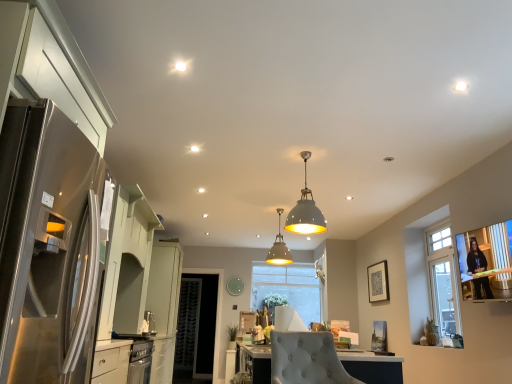
This screenshot has width=512, height=384. What do you see at coordinates (48, 246) in the screenshot? I see `stainless steel refrigerator at left` at bounding box center [48, 246].

What do you see at coordinates (486, 262) in the screenshot? I see `glass window screen at right` at bounding box center [486, 262].

This screenshot has height=384, width=512. I want to click on glass window screen at right, so click(x=486, y=262).

This screenshot has width=512, height=384. In order to click on matte black picture frame at upper right in this screenshot , I will do 378,282.

In order to click on white glossy countertop at lower left in this screenshot , I will do `click(112, 361)`.

What are the coordinates of `clear glass door at center` in the screenshot? It's located at (197, 325).

Describe the element at coordinates (149, 323) in the screenshot. This screenshot has height=384, width=512. I see `satin nickel faucet at lower left` at that location.

This screenshot has width=512, height=384. In order to click on stainless steel refrigerator at left in this screenshot , I will do click(x=48, y=246).

Is satin nickel faucet at lower left next to clear glass window at center and touching it?

No, satin nickel faucet at lower left is not making contact with clear glass window at center.

From the picture: Considering the sizes of objects satin nickel faucet at lower left and clear glass window at center in the image provided, who is shorter, satin nickel faucet at lower left or clear glass window at center?

Standing shorter between the two is satin nickel faucet at lower left.

In the scene shown: Is clear glass window at center inside satin nickel faucet at lower left?

No.

Is glass window screen at right positioned behind stainless steel refrigerator at left?

Yes, glass window screen at right is further from the camera.

Are glass window screen at right and stainless steel refrigerator at left beside each other?

No, glass window screen at right is not touching stainless steel refrigerator at left.

Which is less distant, (x=504, y=289) or (x=49, y=244)?

Point (x=504, y=289) is positioned farther from the camera compared to point (x=49, y=244).

Which of these two, glass window screen at right or stainless steel refrigerator at left, is smaller?

glass window screen at right is smaller.

From the image's perspective, does satin nickel faucet at lower left appear lower than matte black picture frame at upper right?

Yes, from the image's perspective, satin nickel faucet at lower left is beneath matte black picture frame at upper right.

Is point (151, 322) farther from camera compared to point (381, 296)?

No, (151, 322) is in front of (381, 296).

Based on the photo, in terms of size, does satin nickel faucet at lower left appear bigger or smaller than matte black picture frame at upper right?

Clearly, satin nickel faucet at lower left is smaller in size than matte black picture frame at upper right.

Is matte black picture frame at upper right aimed at stainless steel refrigerator at left?

No.

Can you confirm if matte black picture frame at upper right is thinner than stainless steel refrigerator at left?

Yes, matte black picture frame at upper right is thinner than stainless steel refrigerator at left.

Would you say matte black picture frame at upper right contains stainless steel refrigerator at left?

No, matte black picture frame at upper right does not contain stainless steel refrigerator at left.

Considering the relative sizes of matte black picture frame at upper right and white matte pendant light at center, acting as the first lamp starting from the top, in the image provided, is matte black picture frame at upper right shorter than white matte pendant light at center, acting as the first lamp starting from the top,?

Correct, matte black picture frame at upper right is not as tall as white matte pendant light at center, acting as the first lamp starting from the top.

Is matte black picture frame at upper right oriented away from white matte pendant light at center, acting as the first lamp starting from the top?

matte black picture frame at upper right does not have its back to white matte pendant light at center, acting as the first lamp starting from the top.

Image resolution: width=512 pixels, height=384 pixels. Find the location of `picture frame located on the right of white matte pendant light at center, acting as the 2th lamp starting from the bottom`. picture frame located on the right of white matte pendant light at center, acting as the 2th lamp starting from the bottom is located at coordinates (378, 282).

Which is behind, matte black picture frame at upper right or white matte pendant light at center, acting as the 2th lamp starting from the bottom?

matte black picture frame at upper right.

Does glass window screen at right appear on the right side of matte gray pendant light at center, which is the 2th lamp in top-to-bottom order?

Indeed, glass window screen at right is positioned on the right side of matte gray pendant light at center, which is the 2th lamp in top-to-bottom order.

From the image's perspective, is glass window screen at right under matte gray pendant light at center, the 1th lamp from the bottom?

Incorrect, from the image's perspective, glass window screen at right is higher than matte gray pendant light at center, the 1th lamp from the bottom.

Is glass window screen at right inside the boundaries of matte gray pendant light at center, which is the first lamp from back to front, or outside?

The correct answer is: outside.

Based on the photo, can you confirm if glass window screen at right is smaller than matte gray pendant light at center, which is the first lamp from back to front?

No, glass window screen at right is not smaller than matte gray pendant light at center, which is the first lamp from back to front.

Which object is positioned more to the left, matte black picture frame at upper right or clear glass window at center?

From the viewer's perspective, clear glass window at center appears more on the left side.

Based on the photo, which of these two, matte black picture frame at upper right or clear glass window at center, is thinner?

With smaller width is matte black picture frame at upper right.

Find the location of `appliance on the left of the clear glass window at center`. appliance on the left of the clear glass window at center is located at coordinates (149, 323).

The height and width of the screenshot is (384, 512). What are the coordinates of `window screen that appears below the stainless steel refrigerator at left (from the image's perspective)` in the screenshot? It's located at (486, 262).

Estimate the real-world distances between objects in this image. Which object is further from satin nickel faucet at lower left, matte gray pendant light at center, which is the first lamp from back to front, or stainless steel refrigerator at left?

stainless steel refrigerator at left lies further to satin nickel faucet at lower left than the other object.

Which object lies further to the anchor point satin nickel faucet at lower left, matte black picture frame at upper right or white glossy countertop at lower left?

matte black picture frame at upper right is further to satin nickel faucet at lower left.

Based on their spatial positions, is matte black picture frame at upper right or glass window screen at right closer to clear glass door at center?

The object closer to clear glass door at center is matte black picture frame at upper right.

Considering their positions, is matte gray pendant light at center, which is the first lamp from back to front, positioned further to glass window screen at right than white matte pendant light at center, acting as the 2th lamp starting from the bottom?

matte gray pendant light at center, which is the first lamp from back to front, lies further to glass window screen at right than the other object.

Based on the photo, which object lies nearer to the anchor point white matte pendant light at center, acting as the first lamp starting from the top, matte gray pendant light at center, which is counted as the second lamp, starting from the front, or matte black picture frame at upper right?

The object closer to white matte pendant light at center, acting as the first lamp starting from the top, is matte black picture frame at upper right.

Estimate the real-world distances between objects in this image. Which object is further from white glossy countertop at lower left, white matte pendant light at center, positioned as the second lamp in back-to-front order, or clear glass door at center?

The object further to white glossy countertop at lower left is white matte pendant light at center, positioned as the second lamp in back-to-front order.

Looking at the image, which one is located further to stainless steel refrigerator at left, satin nickel faucet at lower left or matte gray pendant light at center, which is counted as the second lamp, starting from the front?

matte gray pendant light at center, which is counted as the second lamp, starting from the front, lies further to stainless steel refrigerator at left than the other object.

Looking at the image, which one is located further to matte black picture frame at upper right, clear glass window at center or white glossy countertop at lower left?

The object further to matte black picture frame at upper right is white glossy countertop at lower left.

Locate an element on the screen. glass door located between white glossy countertop at lower left and matte black picture frame at upper right in the left-right direction is located at coordinates (197, 325).

Locate an element on the screen. This screenshot has height=384, width=512. lamp located between white glossy countertop at lower left and clear glass door at center in the depth direction is located at coordinates click(279, 249).

Locate an element on the screen. The image size is (512, 384). lamp between white matte pendant light at center, acting as the 2th lamp starting from the bottom, and satin nickel faucet at lower left from front to back is located at coordinates (279, 249).

This screenshot has height=384, width=512. What are the coordinates of `window between satin nickel faucet at lower left and matte black picture frame at upper right` in the screenshot? It's located at (287, 289).